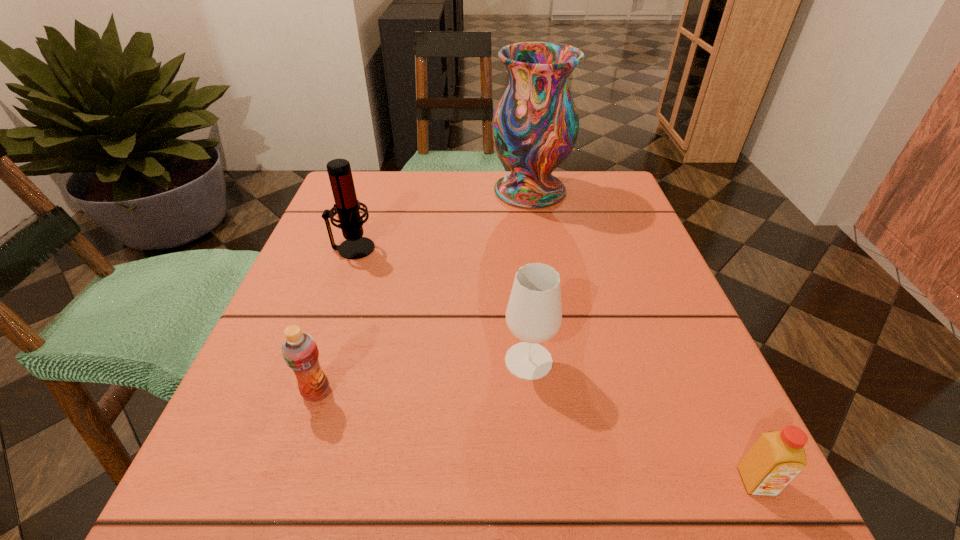
I want to click on the tallest object, so click(x=535, y=125).

Locate an element on the screen. The width and height of the screenshot is (960, 540). the farthest object is located at coordinates (535, 125).

Identify the location of microphone. (347, 206).

You are a GUI agent. You are given a task and a screenshot of the screen. Output one action in this format:
    pyautogui.click(x=<x>, y=<y>)
    Task: Click on the glass
    Image resolution: width=960 pixels, height=540 pixels.
    Given the screenshot: What is the action you would take?
    pyautogui.click(x=534, y=313)

Where is `the fourth tallest object`? The width and height of the screenshot is (960, 540). the fourth tallest object is located at coordinates (300, 352).

Where is `the left orange juice`? the left orange juice is located at coordinates (300, 352).

I want to click on the rightmost object, so click(776, 458).

Find the location of a particular element. This screenshot has width=960, height=540. the shortest object is located at coordinates (776, 458).

Where is `vacant space located on the front of the farthest object`? vacant space located on the front of the farthest object is located at coordinates pyautogui.click(x=539, y=244).

I want to click on blank area located 0.160m on the front of the fourth nearest object, so click(328, 318).